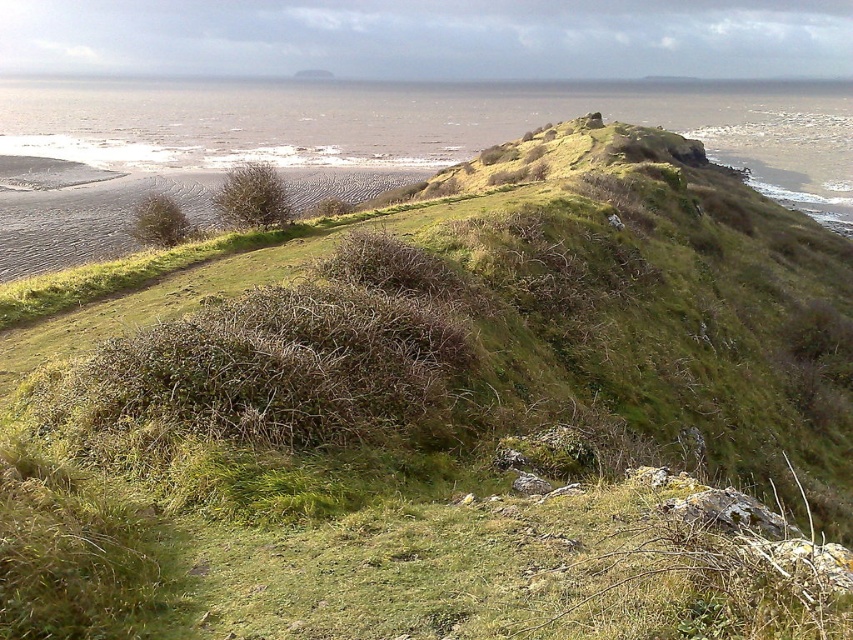
You are standing on the grassy hillside and want to walk towards the ocean. Which direction should you go to first reach the green leafy bush at center before proceeding to the green grassy bush at lower left?

You should head towards the green leafy bush at center first since it is closer to you than the green grassy bush at lower left. After reaching it, continue towards the green grassy bush at lower left.

You are standing at the base of the grassy hillside in the coastal landscape. You want to place a small garden statue exactly at the point marked by coordinates point (251,198). What will be under the statue once it is placed?

The point marked by coordinates point (251,198) has a green leafy bush at center, so placing the statue there would cover the green leafy bush at center.